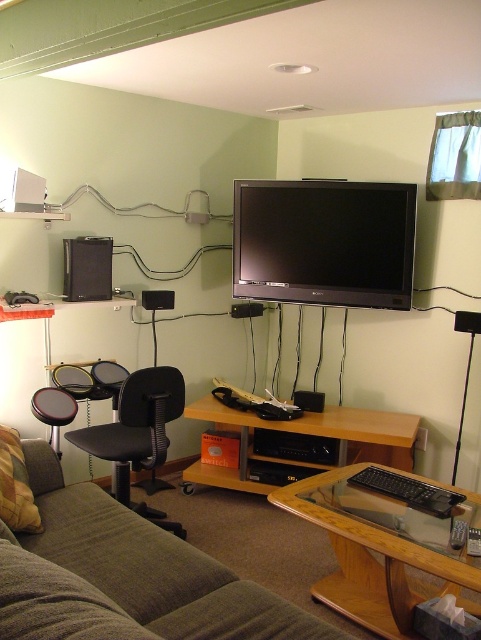
Question: Is woodendesk at lower center to the left of black plastic speaker at center from the viewer's perspective?

Choices:
 (A) yes
 (B) no

Answer: (B)

Question: Which is nearer to the flat screen tv at upper center?

Choices:
 (A) woodendesk at lower center
 (B) black mesh swivel chair at center
 (C) black plastic speaker at center

Answer: (C)

Question: Which of the following is the farthest from the observer?

Choices:
 (A) coord(149,378)
 (B) coord(341,244)
 (C) coord(339,420)
 (D) coord(388,604)

Answer: (B)

Question: Does dark gray fabric couch at lower left have a greater width compared to flat screen tv at upper center?

Choices:
 (A) yes
 (B) no

Answer: (A)

Question: Considering the real-world distances, which object is closest to the woodendesk at lower center?

Choices:
 (A) flat screen tv at upper center
 (B) transparent glass coffee table at lower center
 (C) black plastic speaker at upper left
 (D) black mesh swivel chair at center

Answer: (D)

Question: Is dark gray fabric couch at lower left smaller than black plastic speaker at center?

Choices:
 (A) yes
 (B) no

Answer: (B)